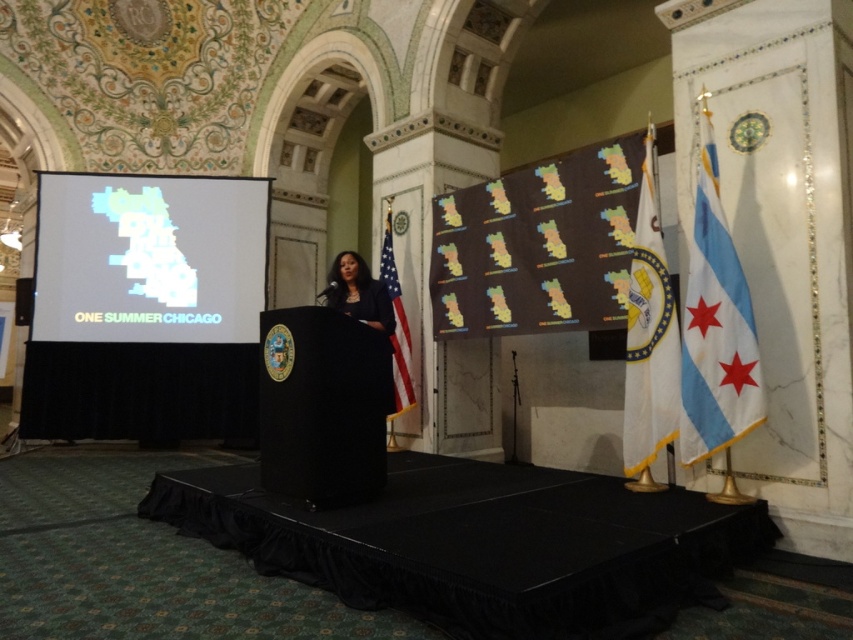
Question: Considering the relative positions of translucent plastic map at left and blue fabric flag at right in the image provided, where is translucent plastic map at left located with respect to blue fabric flag at right?

Choices:
 (A) left
 (B) right

Answer: (A)

Question: Among these objects, which one is nearest to the camera?

Choices:
 (A) blue fabric flag at right
 (B) white fabric flag at right
 (C) american flag at center

Answer: (A)

Question: Can you confirm if translucent plastic map at left is thinner than blue fabric flag at right?

Choices:
 (A) no
 (B) yes

Answer: (A)

Question: Which point appears farthest from the camera in this image?

Choices:
 (A) (643, 442)
 (B) (354, 301)
 (C) (397, 294)

Answer: (C)

Question: Is white fabric flag at right positioned in front of american flag at center?

Choices:
 (A) yes
 (B) no

Answer: (A)

Question: Which of the following is the closest to the observer?

Choices:
 (A) (370, 300)
 (B) (666, 356)
 (C) (393, 417)

Answer: (B)